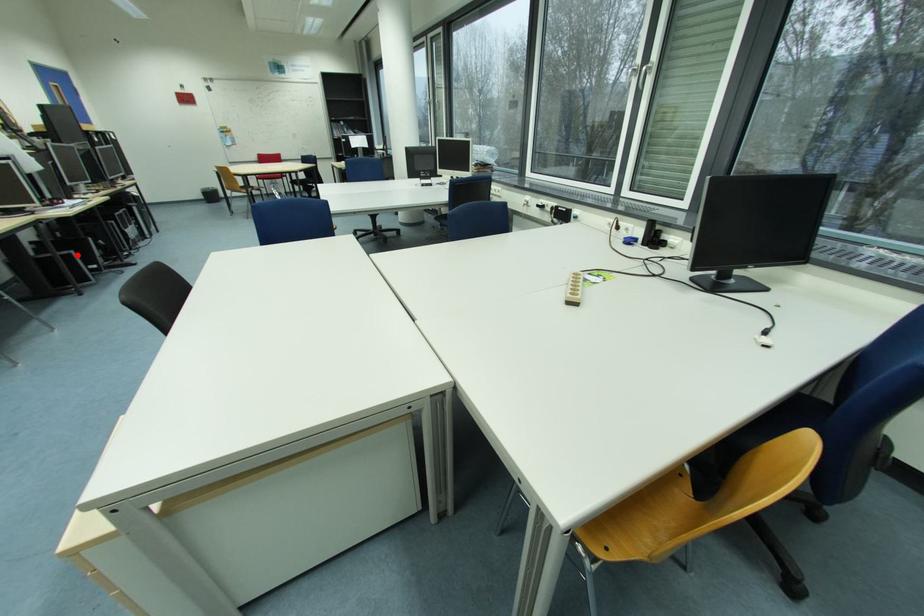
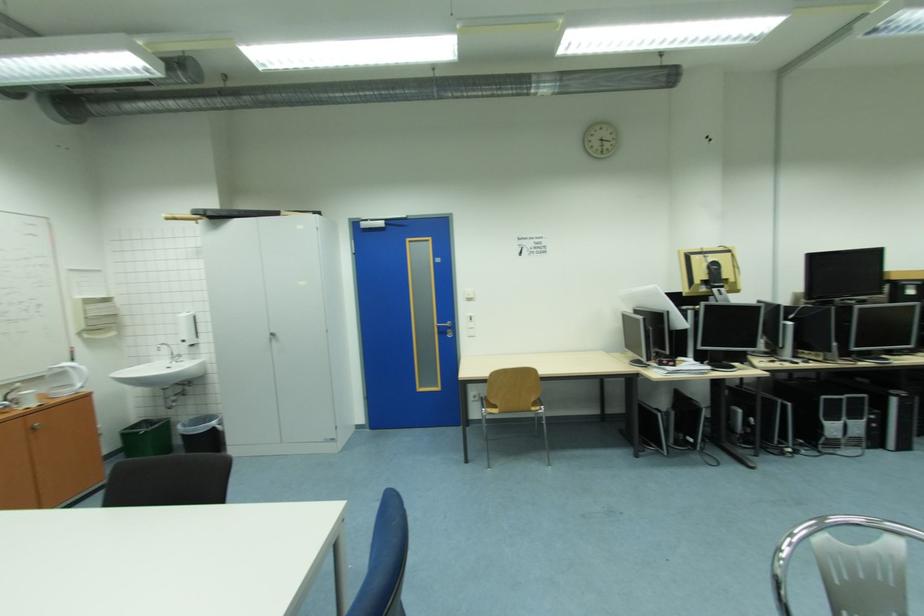
Question: I am providing you with two images of the same scene from different viewpoints. Given a red point in image1, look at the same physical point in image2. Is it:

Choices:
 (A) Closer to the viewpoint
 (B) Farther from the viewpoint

Answer: (A)